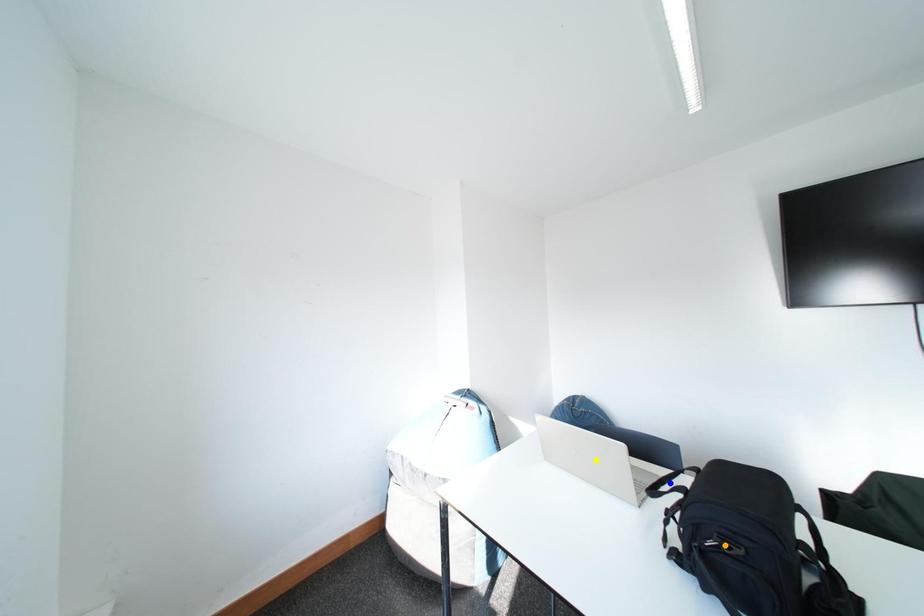
Order these from farthest to nearest:
orange point | blue point | yellow point

yellow point < blue point < orange point